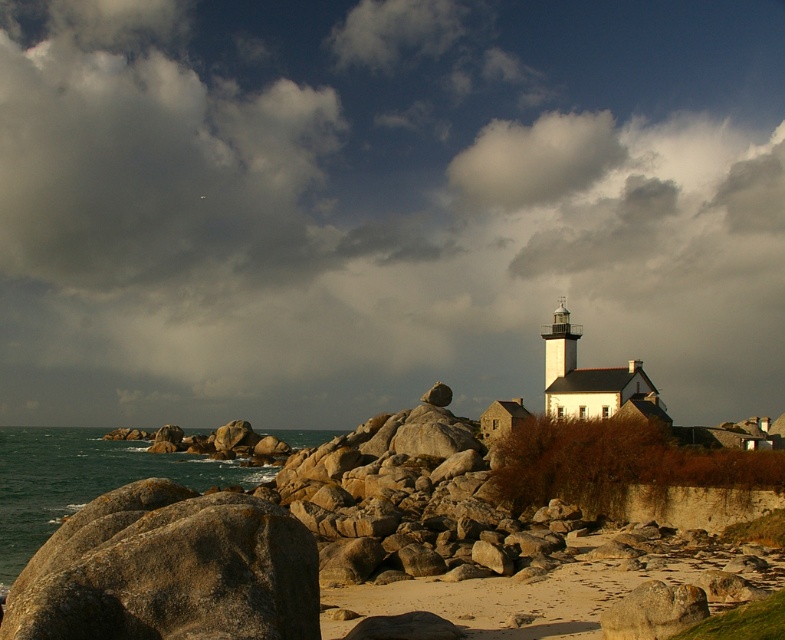
Question: Among these points, which one is nearest to the camera?

Choices:
 (A) (35, 592)
 (B) (24, 547)

Answer: (A)

Question: Among these points, which one is farthest from the camera?

Choices:
 (A) (163, 472)
 (B) (314, 563)

Answer: (A)

Question: Is brown rough rock at lower left below greenish-blue water at lower left?

Choices:
 (A) no
 (B) yes

Answer: (A)

Question: Does cloudy sky at upper center have a lesser width compared to greenish-blue water at lower left?

Choices:
 (A) yes
 (B) no

Answer: (B)

Question: Does cloudy sky at upper center have a smaller size compared to brown rough rock at lower left?

Choices:
 (A) yes
 (B) no

Answer: (B)

Question: Which point is farther to the camera?

Choices:
 (A) brown rough rock at lower left
 (B) cloudy sky at upper center

Answer: (B)